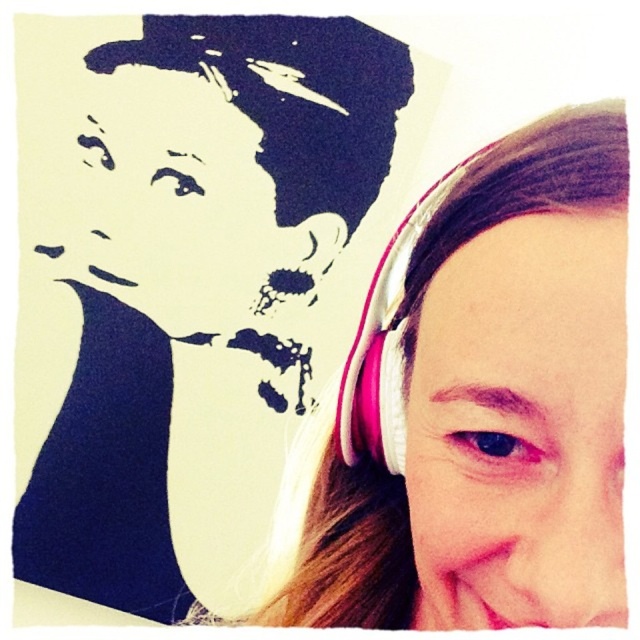
You are designing a display case for a tech exhibition. The case has a width of 20 cm. You need to place both the pink fabric headphones at right and the pink fabric earphone at upper right inside. Based on the scene description, will both items fit side by side within the case?

The pink fabric headphones at right are wider than the pink fabric earphone at upper right. Since the case is only 20 cm wide, we cannot determine if both will fit without knowing their exact widths. However, if the combined width of both items exceeds 20 cm, they won

You are designing a display case for a tech store. The case has a limited space where the pink matte headphones at right and the pink fabric earphone at upper right must be placed. Based on their sizes, which item should be placed first to ensure both fit properly?

The pink fabric earphone at upper right should be placed first because it is smaller than the pink matte headphones at right, allowing enough space for both items in the display case.

You are a photographer adjusting lighting for a photo shoot. You notice the pink matte headphones at right and the pink fabric earphone at upper right. Which object should you focus your spotlight on to ensure it stands out more due to its height?

The pink matte headphones at right should be focused on because it is much taller than the pink fabric earphone at upper right, making it more prominent in height.